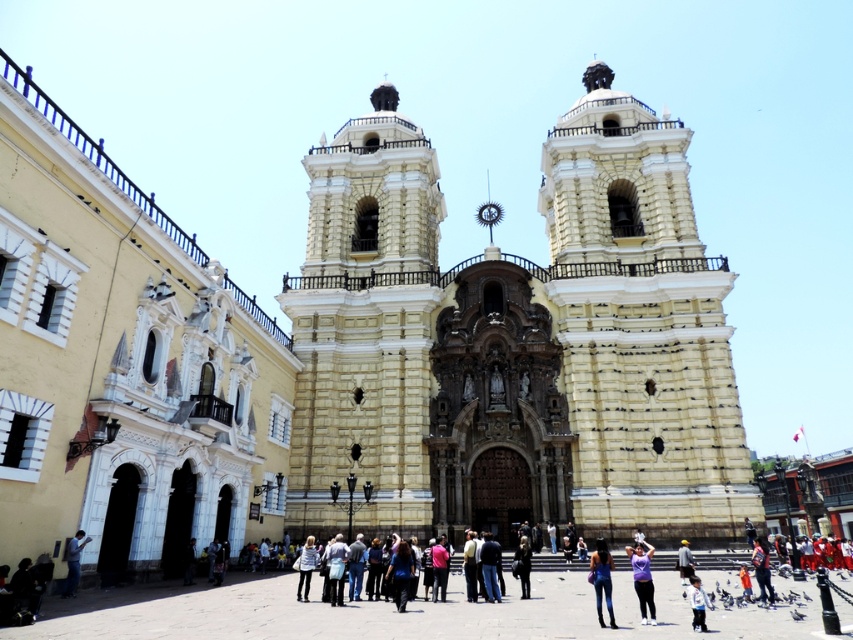
Does white textured coat at lower center have a larger size compared to white cotton shirt at center?

Indeed, white textured coat at lower center has a larger size compared to white cotton shirt at center.

Which is behind, point (305, 588) or point (697, 612)?

Positioned behind is point (305, 588).

You are a GUI agent. You are given a task and a screenshot of the screen. Output one action in this format:
    pyautogui.click(x=<x>, y=<y>)
    Task: Click on the white textured coat at lower center
    The height and width of the screenshot is (640, 853).
    Given the screenshot: What is the action you would take?
    pyautogui.click(x=306, y=566)

Does black leather jacket at center have a larger size compared to white cotton shirt at center?

Correct, black leather jacket at center is larger in size than white cotton shirt at center.

Which is more to the right, black leather jacket at center or white cotton shirt at center?

white cotton shirt at center is more to the right.

Who is more forward, [527,541] or [689,596]?

Point [689,596]

Where is `black leather jacket at center`? black leather jacket at center is located at coordinates (521, 564).

Who is shorter, denim pants at lower left or white cotton shirt at center?

denim pants at lower left is shorter.

Is denim pants at lower left below white cotton shirt at center?

No.

Is point (79, 531) positioned behind point (701, 612)?

Yes, point (79, 531) is farther from viewer.

Locate an element on the screen. Image resolution: width=853 pixels, height=640 pixels. denim pants at lower left is located at coordinates 73,561.